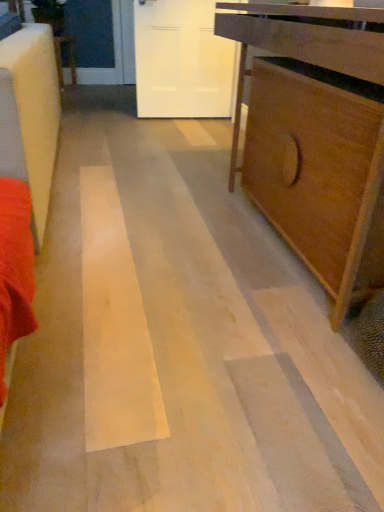
This screenshot has height=512, width=384. What do you see at coordinates (182, 61) in the screenshot? I see `white matte door at upper center` at bounding box center [182, 61].

Identify the location of matte brown cabinet at right. (316, 170).

Is point (159, 73) farther from viewer compared to point (62, 76)?

No, (159, 73) is in front of (62, 76).

Consider the image. Is white matte door at upper center turned away from wooden table at center?

That's not correct — white matte door at upper center is not looking away from wooden table at center.

Is white matte door at upper center next to wooden table at center and touching it?

white matte door at upper center and wooden table at center are clearly separated.

How different are the orientations of white matte door at upper center and wooden table at center in degrees?

white matte door at upper center and wooden table at center are facing 175 degrees away from each other.

Which is closer to the camera, (68, 50) or (329, 276)?

The point (329, 276) is more forward.

Can you confirm if wooden table at center is wider than matte brown cabinet at right?

No, wooden table at center is not wider than matte brown cabinet at right.

Is matte brown cabinet at right completely or partially inside wooden table at center?

No, matte brown cabinet at right is not a part of wooden table at center.

Does point (263, 132) come closer to viewer compared to point (73, 75)?

Yes, point (263, 132) is closer to viewer.

Between matte brown cabinet at right and wooden table at center, which one has smaller width?

Thinner between the two is wooden table at center.

The height and width of the screenshot is (512, 384). Find the location of `furniture behind the matte brown cabinet at right`. furniture behind the matte brown cabinet at right is located at coordinates (61, 57).

Which of these two, white matte door at upper center or matte brown cabinet at right, is wider?

matte brown cabinet at right is wider.

Is white matte door at upper center to the right of matte brown cabinet at right from the viewer's perspective?

Incorrect, white matte door at upper center is not on the right side of matte brown cabinet at right.

From a real-world perspective, between white matte door at upper center and matte brown cabinet at right, who is vertically lower?

matte brown cabinet at right, from a real-world perspective.

From the image's perspective, who appears lower, matte brown cabinet at right or white matte door at upper center?

matte brown cabinet at right, from the image's perspective.

Is matte brown cabinet at right taller or shorter than white matte door at upper center?

Clearly, matte brown cabinet at right is shorter compared to white matte door at upper center.

Does point (55, 38) appear closer or farther from the camera than point (175, 95)?

Point (55, 38) appears to be farther away from the viewer than point (175, 95).

Considering the sizes of objects wooden table at center and white matte door at upper center in the image provided, who is bigger, wooden table at center or white matte door at upper center?

Bigger between the two is white matte door at upper center.

Is the surface of wooden table at center in direct contact with white matte door at upper center?

No, wooden table at center is not next to white matte door at upper center.

Is wooden table at center aimed at white matte door at upper center?

No.

Find the location of `furniture located behind the white matte door at upper center`. furniture located behind the white matte door at upper center is located at coordinates (61, 57).

Find the location of `furniture on the left side of matte brown cabinet at right`. furniture on the left side of matte brown cabinet at right is located at coordinates [61, 57].

Which object lies further to the anchor point matte brown cabinet at right, white matte door at upper center or wooden table at center?

Based on the image, wooden table at center appears to be further to matte brown cabinet at right.

Estimate the real-world distances between objects in this image. Which object is closer to white matte door at upper center, matte brown cabinet at right or wooden table at center?

wooden table at center.

Based on their spatial positions, is wooden table at center or white matte door at upper center further from matte brown cabinet at right?

wooden table at center.

From the picture: Looking at the image, which one is located further to white matte door at upper center, wooden table at center or matte brown cabinet at right?

The object further to white matte door at upper center is matte brown cabinet at right.

From the image, which object appears to be nearer to wooden table at center, matte brown cabinet at right or white matte door at upper center?

white matte door at upper center lies closer to wooden table at center than the other object.

Which object lies further to the anchor point wooden table at center, white matte door at upper center or matte brown cabinet at right?

matte brown cabinet at right.

Locate an element on the screen. door between matte brown cabinet at right and wooden table at center in the front-back direction is located at coordinates (182, 61).